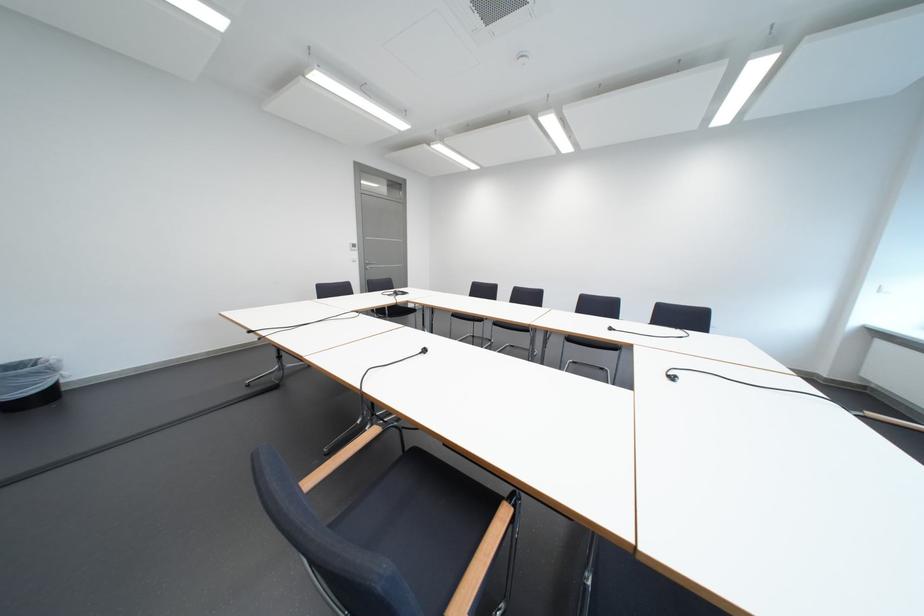
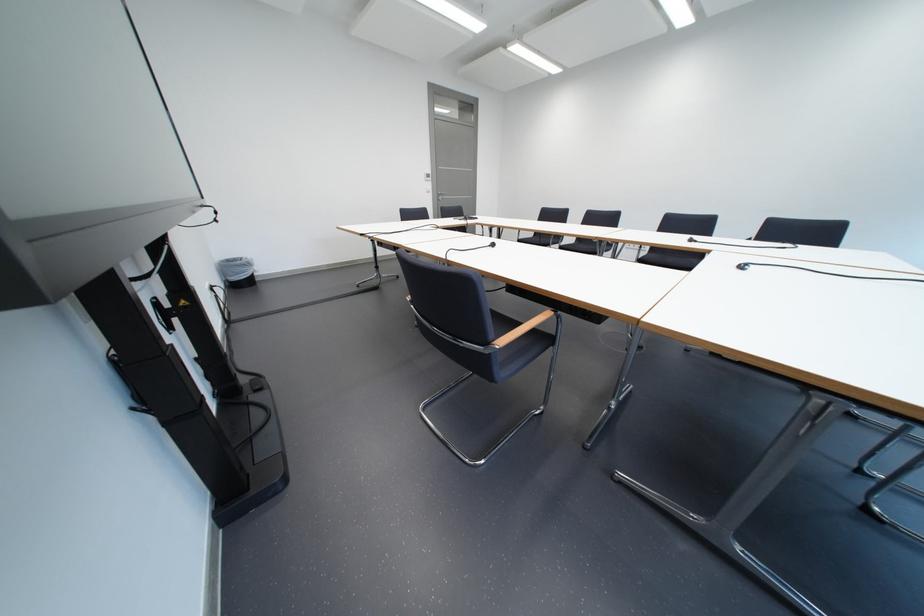
Question: Based on the continuous images, in which direction is the camera rotating? Reply with the corresponding letter.

Choices:
 (A) Left
 (B) Right
 (C) Up
 (D) Down

Answer: (A)